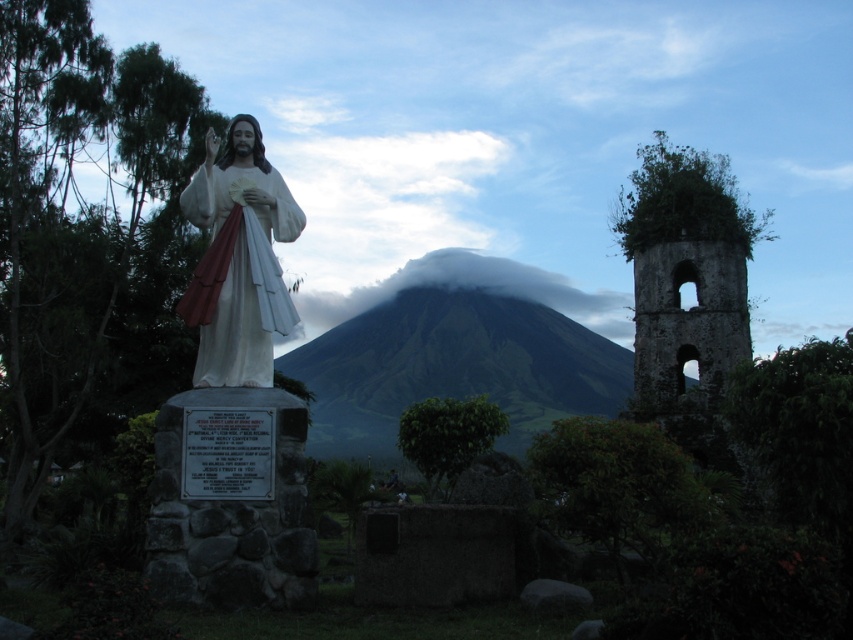
You are a photographer planning to take a photo of the white glossy statue at center and the green grassy mountain at center. Based on their positions, which object should appear larger in the photo?

The white glossy statue at center appears larger in the photo because it is positioned above the green grassy mountain at center, making it closer to the camera.

You are a photographer planning to capture a landscape photo that includes both the white glossy statue at center and the white fluffy cloud at center. Based on their sizes, which object would appear smaller in the final photo?

The white glossy statue at center is shorter than the white fluffy cloud at center, so it would appear smaller in the photo.

You are a photographer planning to capture the statue of Jesus Christ in the foreground with the green grassy mountain at center and the white fluffy cloud at center in the background. Based on their sizes, which object should you focus on to ensure the statue is the main subject?

The green grassy mountain at center might be wider than the white fluffy cloud at center, so focusing on the statue of Jesus Christ with the green grassy mountain at center in the background would make the statue the main subject as the mountain provides a broader backdrop compared to the cloud.